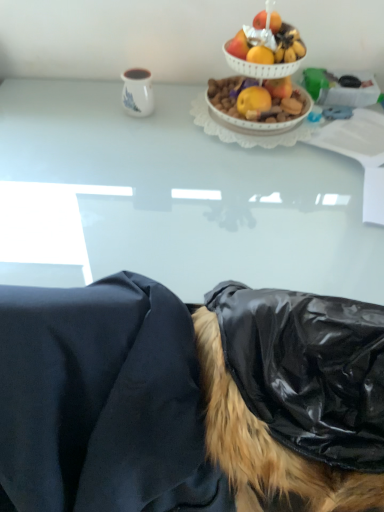
Question: Can you confirm if black glossy wig at lower right is positioned to the right of white glossy table at upper center?

Choices:
 (A) yes
 (B) no

Answer: (A)

Question: Is white glossy table at upper center a part of black glossy wig at lower right?

Choices:
 (A) yes
 (B) no

Answer: (B)

Question: Considering the relative sizes of black glossy wig at lower right and white glossy table at upper center in the image provided, is black glossy wig at lower right bigger than white glossy table at upper center?

Choices:
 (A) yes
 (B) no

Answer: (B)

Question: Can you confirm if black glossy wig at lower right is shorter than white glossy table at upper center?

Choices:
 (A) no
 (B) yes

Answer: (A)

Question: Is black glossy wig at lower right oriented towards white glossy table at upper center?

Choices:
 (A) no
 (B) yes

Answer: (B)

Question: Considering the relative positions of black glossy wig at lower right and white glossy table at upper center in the image provided, is black glossy wig at lower right to the left of white glossy table at upper center from the viewer's perspective?

Choices:
 (A) no
 (B) yes

Answer: (A)

Question: Is there a large distance between black fabric at lower center and black glossy wig at lower right?

Choices:
 (A) yes
 (B) no

Answer: (B)

Question: From a real-world perspective, is black fabric at lower center under black glossy wig at lower right?

Choices:
 (A) no
 (B) yes

Answer: (B)

Question: Is black fabric at lower center positioned in front of black glossy wig at lower right?

Choices:
 (A) no
 (B) yes

Answer: (A)

Question: Can you confirm if black fabric at lower center is bigger than black glossy wig at lower right?

Choices:
 (A) no
 (B) yes

Answer: (B)

Question: Does black fabric at lower center appear on the right side of black glossy wig at lower right?

Choices:
 (A) no
 (B) yes

Answer: (A)

Question: Can black glossy wig at lower right be found inside black fabric at lower center?

Choices:
 (A) yes
 (B) no

Answer: (B)

Question: Considering the relative positions of shiny white bowl at upper center and black fabric at lower center in the image provided, is shiny white bowl at upper center to the left of black fabric at lower center from the viewer's perspective?

Choices:
 (A) no
 (B) yes

Answer: (A)